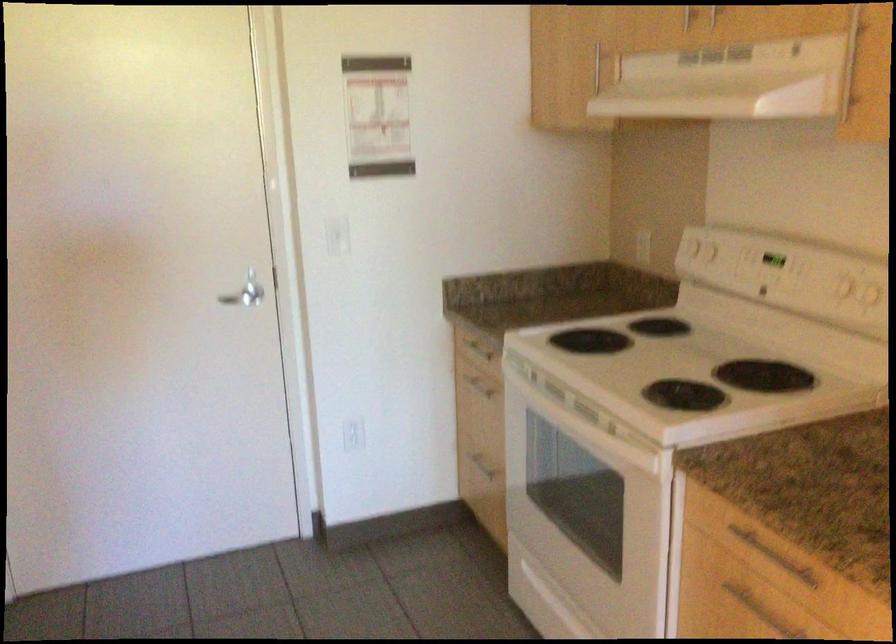
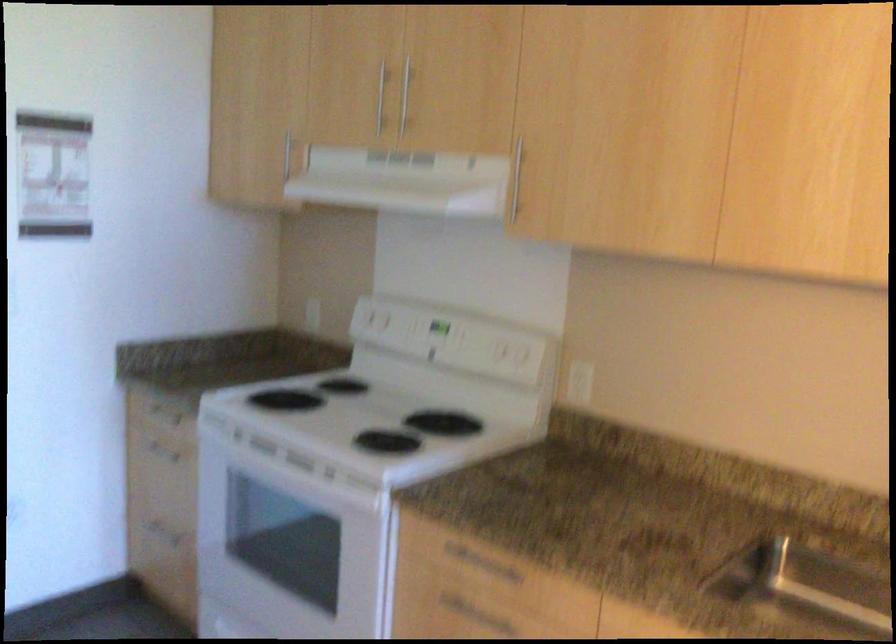
In the second image, find the point that corresponds to point 668,538 in the first image.

(385, 571)